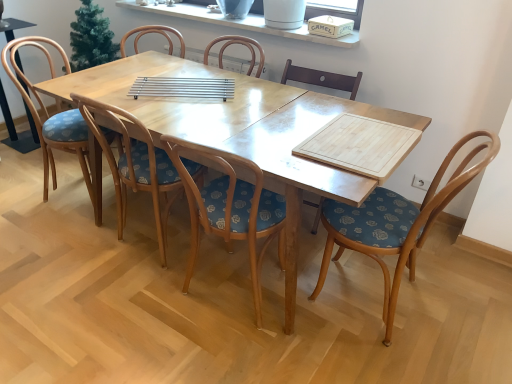
Locate an element on the screen. The height and width of the screenshot is (384, 512). free space in front of wooden chair with floral upholstery at center, positioned as the second chair in left-to-right order is located at coordinates (126, 322).